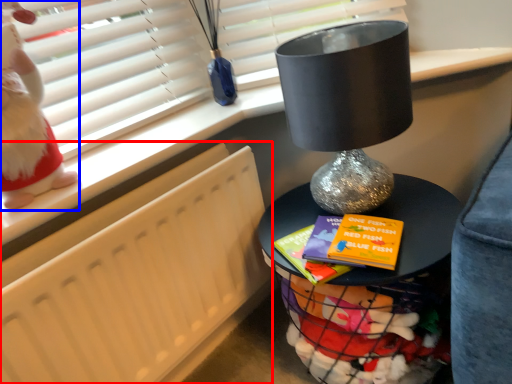
Question: Which of the following is the closest to the observer, radiator (highlighted by a red box) or doll (highlighted by a blue box)?

Choices:
 (A) radiator
 (B) doll

Answer: (B)